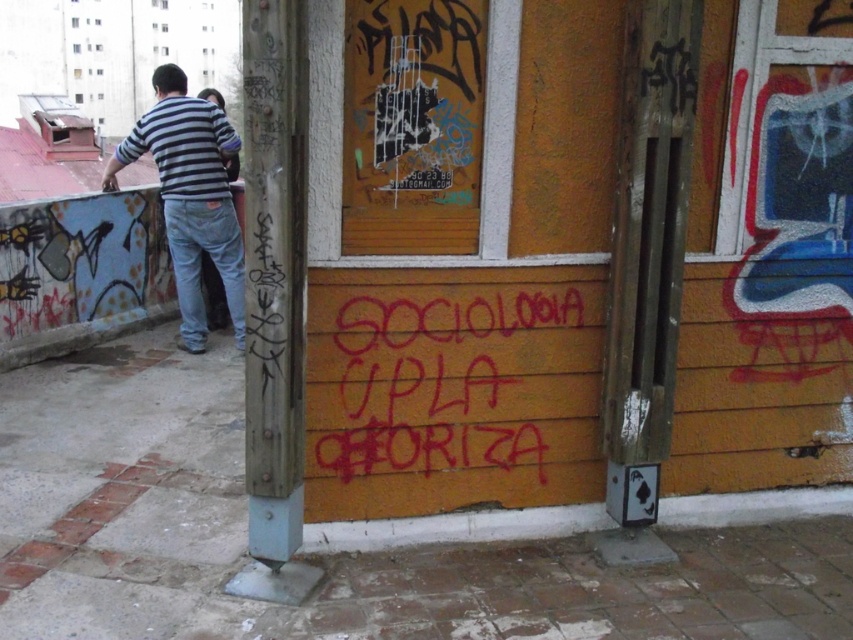
Is red graffiti at center above striped cotton shirt at left?

No.

How much distance is there between red graffiti at center and striped cotton shirt at left?

red graffiti at center is 9.10 feet away from striped cotton shirt at left.

Image resolution: width=853 pixels, height=640 pixels. In order to click on red graffiti at center in this screenshot , I will do `click(450, 380)`.